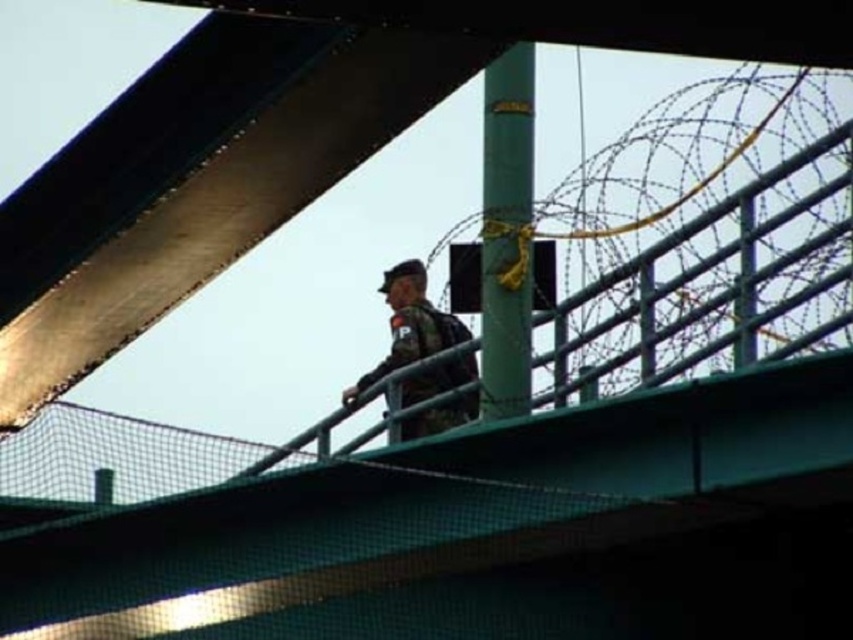
Question: Estimate the real-world distances between objects in this image. Which object is closer to the green matte pole at center?

Choices:
 (A) camouflage fabric uniform at center
 (B) black mesh fence at upper center

Answer: (A)

Question: Is the position of black mesh fence at upper center more distant than that of camouflage fabric uniform at center?

Choices:
 (A) yes
 (B) no

Answer: (B)

Question: Among these objects, which one is farthest from the camera?

Choices:
 (A) black mesh fence at upper center
 (B) green matte pole at center

Answer: (B)

Question: Which point appears closest to the camera in this image?

Choices:
 (A) (416, 316)
 (B) (109, 422)

Answer: (B)

Question: From the image, what is the correct spatial relationship of black mesh fence at upper center in relation to green matte pole at center?

Choices:
 (A) above
 (B) below

Answer: (B)

Question: Where is black mesh fence at upper center located in relation to green matte pole at center in the image?

Choices:
 (A) below
 (B) above

Answer: (A)